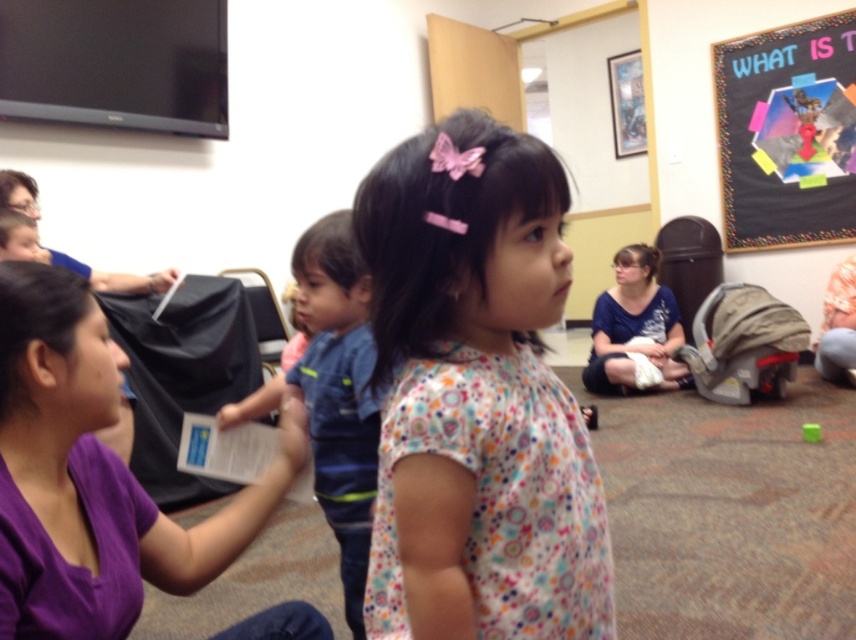
Who is lower down, floral cotton dress at center or black matte poster at upper right?

floral cotton dress at center

Is point (528, 502) farther from viewer compared to point (774, 166)?

No, (528, 502) is closer to viewer.

The width and height of the screenshot is (856, 640). Identify the location of floral cotton dress at center. (476, 396).

Where is `floral cotton dress at center`? The height and width of the screenshot is (640, 856). floral cotton dress at center is located at coordinates (476, 396).

Does black matte poster at upper right lie behind blue cotton shirt at center?

That is True.

Is point (825, 44) closer to camera compared to point (623, 321)?

No.

The image size is (856, 640). I want to click on black matte poster at upper right, so click(x=788, y=134).

The image size is (856, 640). I want to click on black matte poster at upper right, so click(788, 134).

Is floral cotton dress at center positioned behind purple fabric shirt at center?

Yes, floral cotton dress at center is further from the viewer.

Who is taller, floral cotton dress at center or purple fabric shirt at center?

floral cotton dress at center

Between point (507, 616) and point (57, 380), which one is positioned in front?

Point (507, 616) is more forward.

Where is `floral cotton dress at center`? floral cotton dress at center is located at coordinates (476, 396).